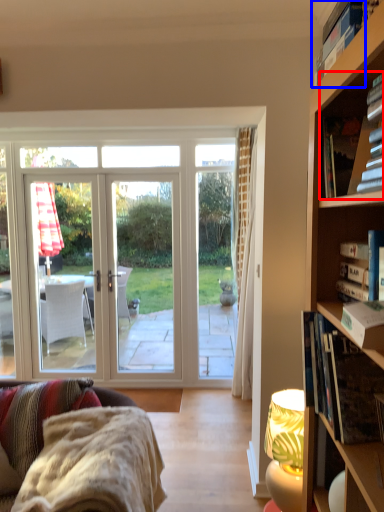
Question: Which object is further to the camera taking this photo, book (highlighted by a red box) or book (highlighted by a blue box)?

Choices:
 (A) book
 (B) book

Answer: (A)